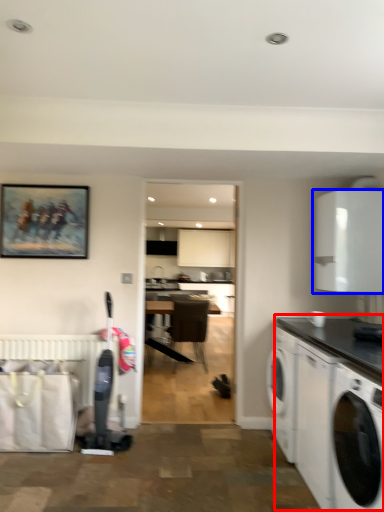
Question: Which point is closer to the camera, counter (highlighted by a red box) or cabinetry (highlighted by a blue box)?

Choices:
 (A) counter
 (B) cabinetry

Answer: (A)